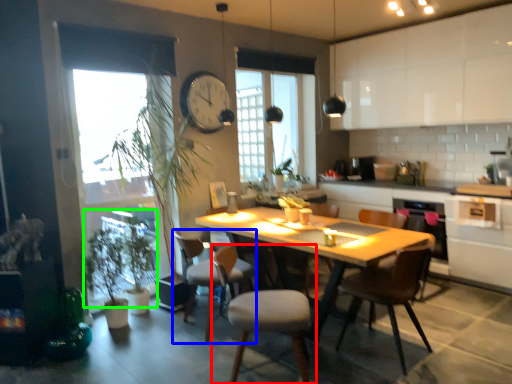
Question: Estimate the real-world distances between objects in this image. Which object is closer to chair (highlighted by a red box), chair (highlighted by a blue box) or plant (highlighted by a green box)?

Choices:
 (A) chair
 (B) plant

Answer: (A)